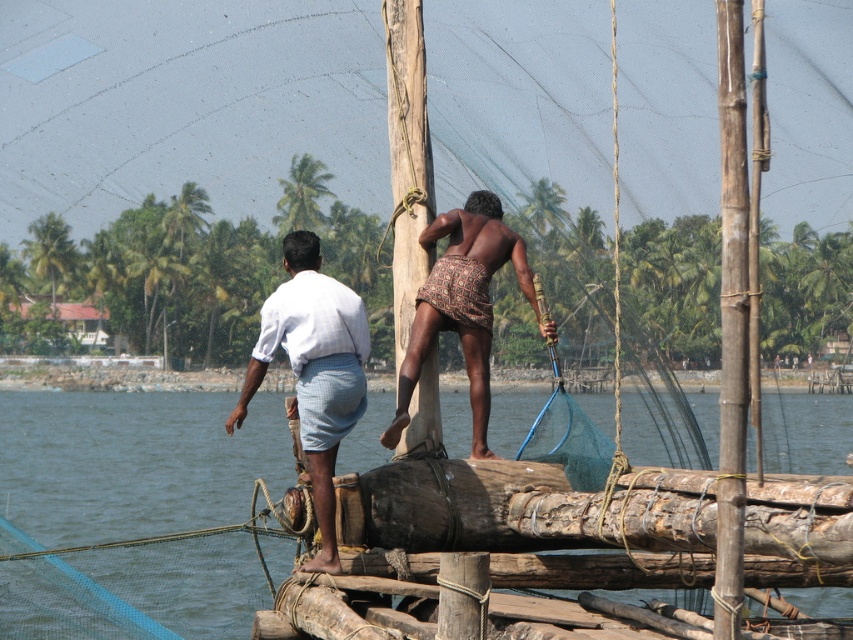
Is white checkered cloth at center taller than patterned fabric shorts at center?

No, white checkered cloth at center is not taller than patterned fabric shorts at center.

Based on the photo, does white checkered cloth at center lie in front of patterned fabric shorts at center?

Yes, it is in front of patterned fabric shorts at center.

What do you see at coordinates (312, 371) in the screenshot?
I see `white checkered cloth at center` at bounding box center [312, 371].

What are the coordinates of `white checkered cloth at center` in the screenshot? It's located at (312, 371).

Can you confirm if transparent blue water at center is wider than white checkered cloth at center?

Correct, the width of transparent blue water at center exceeds that of white checkered cloth at center.

Find the location of a particular element. transparent blue water at center is located at coordinates (132, 461).

Find the location of a particular element. The image size is (853, 640). transparent blue water at center is located at coordinates (132, 461).

Is transparent blue water at center thinner than brown woven cloth at center?

No, transparent blue water at center is not thinner than brown woven cloth at center.

Is transparent blue water at center smaller than brown woven cloth at center?

No, transparent blue water at center is not smaller than brown woven cloth at center.

Who is more distant from viewer, (96, 624) or (442, 220)?

Positioned behind is point (442, 220).

Locate an element on the screen. The image size is (853, 640). transparent blue water at center is located at coordinates (132, 461).